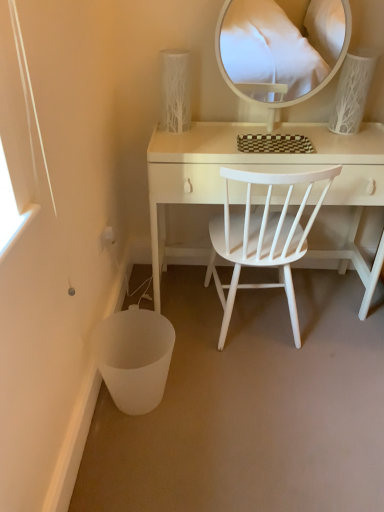
Question: Which direction should I rotate to look at white textured vase at upper center, the 2th table lamp viewed from the right?

Choices:
 (A) left
 (B) right

Answer: (A)

Question: Can white textured vase at upper center, which ranks as the 1th table lamp in left-to-right order, be found inside white textured vase at upper right, the second table lamp positioned from the left?

Choices:
 (A) no
 (B) yes

Answer: (A)

Question: Is white textured vase at upper right, the 1th table lamp when ordered from right to left, positioned far away from white textured vase at upper center, which ranks as the 1th table lamp in left-to-right order?

Choices:
 (A) no
 (B) yes

Answer: (A)

Question: From the image's perspective, does white textured vase at upper right, the 1th table lamp when ordered from right to left, appear lower than white textured vase at upper center, the 2th table lamp viewed from the right?

Choices:
 (A) no
 (B) yes

Answer: (B)

Question: From the image's perspective, is white textured vase at upper right, the second table lamp positioned from the left, on top of white textured vase at upper center, the 2th table lamp viewed from the right?

Choices:
 (A) no
 (B) yes

Answer: (A)

Question: Can you confirm if white textured vase at upper right, the second table lamp positioned from the left, is thinner than white textured vase at upper center, the 2th table lamp viewed from the right?

Choices:
 (A) yes
 (B) no

Answer: (B)

Question: From a real-world perspective, does white textured vase at upper right, the second table lamp positioned from the left, sit lower than white textured vase at upper center, which ranks as the 1th table lamp in left-to-right order?

Choices:
 (A) no
 (B) yes

Answer: (A)

Question: Can you confirm if white textured vase at upper center, the 2th table lamp viewed from the right, is positioned to the left of white wood chair at center?

Choices:
 (A) yes
 (B) no

Answer: (A)

Question: Does white textured vase at upper center, which ranks as the 1th table lamp in left-to-right order, have a lesser height compared to white wood chair at center?

Choices:
 (A) yes
 (B) no

Answer: (A)

Question: From the image's perspective, does white textured vase at upper center, the 2th table lamp viewed from the right, appear lower than white wood chair at center?

Choices:
 (A) no
 (B) yes

Answer: (A)

Question: Is white textured vase at upper center, which ranks as the 1th table lamp in left-to-right order, aimed at white wood chair at center?

Choices:
 (A) no
 (B) yes

Answer: (A)

Question: From the image's perspective, is white textured vase at upper center, the 2th table lamp viewed from the right, above white wood chair at center?

Choices:
 (A) yes
 (B) no

Answer: (A)

Question: From a real-world perspective, is white textured vase at upper center, the 2th table lamp viewed from the right, positioned over white wood chair at center based on gravity?

Choices:
 (A) no
 (B) yes

Answer: (B)

Question: Is white textured vase at upper center, which ranks as the 1th table lamp in left-to-right order, oriented towards white wood desk at center?

Choices:
 (A) no
 (B) yes

Answer: (A)